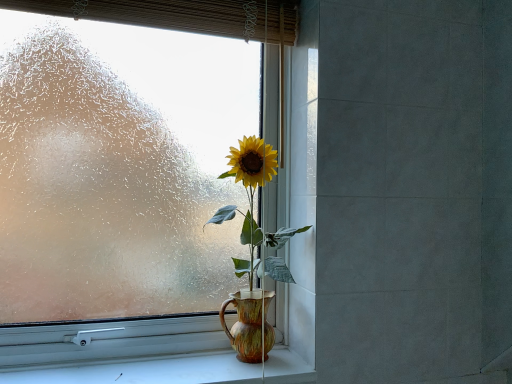
Question: From a real-world perspective, is white smooth window sill at lower center over matte ceramic vase at center?

Choices:
 (A) no
 (B) yes

Answer: (A)

Question: Can you confirm if white smooth window sill at lower center is wider than matte ceramic vase at center?

Choices:
 (A) yes
 (B) no

Answer: (A)

Question: Can we say white smooth window sill at lower center lies outside matte ceramic vase at center?

Choices:
 (A) yes
 (B) no

Answer: (A)

Question: Can you confirm if white smooth window sill at lower center is bigger than matte ceramic vase at center?

Choices:
 (A) no
 (B) yes

Answer: (A)

Question: Does white smooth window sill at lower center turn towards matte ceramic vase at center?

Choices:
 (A) yes
 (B) no

Answer: (B)

Question: Looking at their shapes, would you say white smooth window sill at lower center is wider or thinner than frosted glass window at center?

Choices:
 (A) thin
 (B) wide

Answer: (B)

Question: Is white smooth window sill at lower center taller or shorter than frosted glass window at center?

Choices:
 (A) tall
 (B) short

Answer: (B)

Question: Considering their positions, is white smooth window sill at lower center located in front of or behind frosted glass window at center?

Choices:
 (A) behind
 (B) front

Answer: (B)

Question: In terms of size, does white smooth window sill at lower center appear bigger or smaller than frosted glass window at center?

Choices:
 (A) big
 (B) small

Answer: (B)

Question: Is bamboo curtain at upper center in front of or behind frosted glass window at center in the image?

Choices:
 (A) front
 (B) behind

Answer: (A)

Question: Is bamboo curtain at upper center wider or thinner than frosted glass window at center?

Choices:
 (A) thin
 (B) wide

Answer: (A)

Question: From a real-world perspective, is bamboo curtain at upper center physically located above or below frosted glass window at center?

Choices:
 (A) below
 (B) above

Answer: (B)

Question: Is bamboo curtain at upper center taller or shorter than frosted glass window at center?

Choices:
 (A) short
 (B) tall

Answer: (A)

Question: From a real-world perspective, is frosted glass window at center physically located above or below bamboo curtain at upper center?

Choices:
 (A) above
 (B) below

Answer: (B)

Question: Looking at their shapes, would you say frosted glass window at center is wider or thinner than bamboo curtain at upper center?

Choices:
 (A) wide
 (B) thin

Answer: (A)